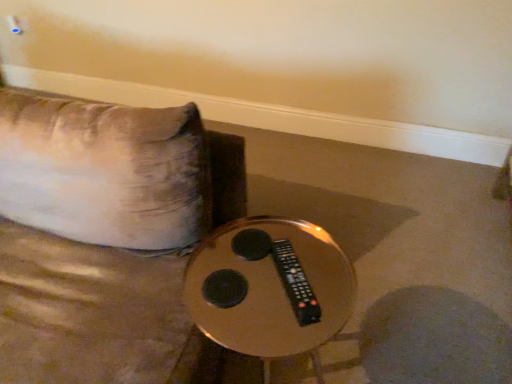
The height and width of the screenshot is (384, 512). Identify the location of vacant area on top of metallic gold table at center (from a real-world perspective). (x=270, y=280).